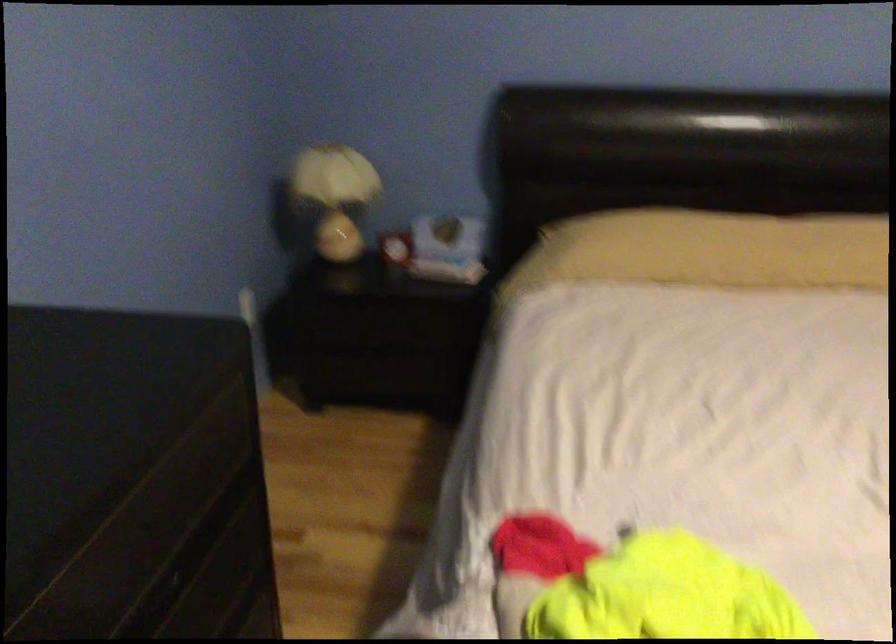
Identify the location of dark drawer front. This screenshot has width=896, height=644. [186, 559].